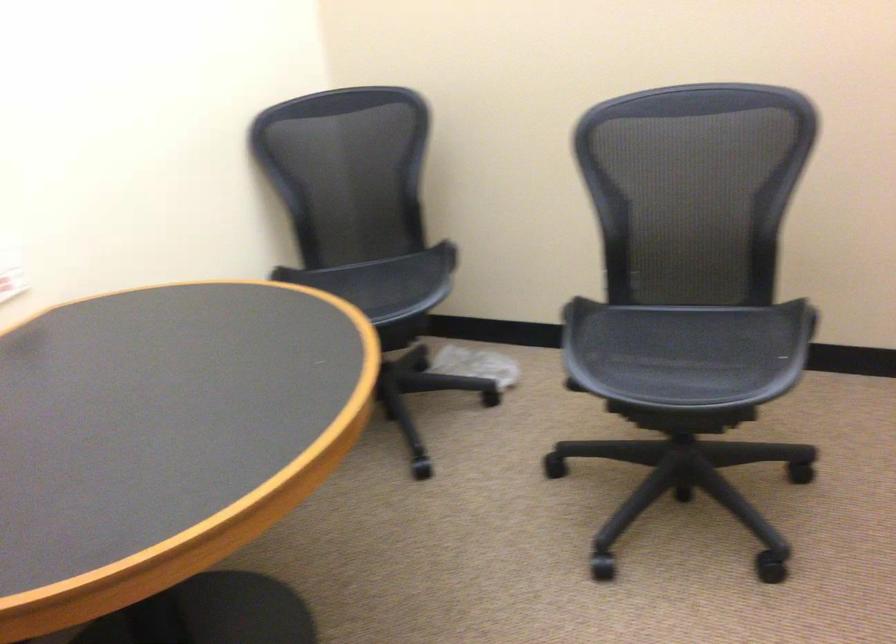
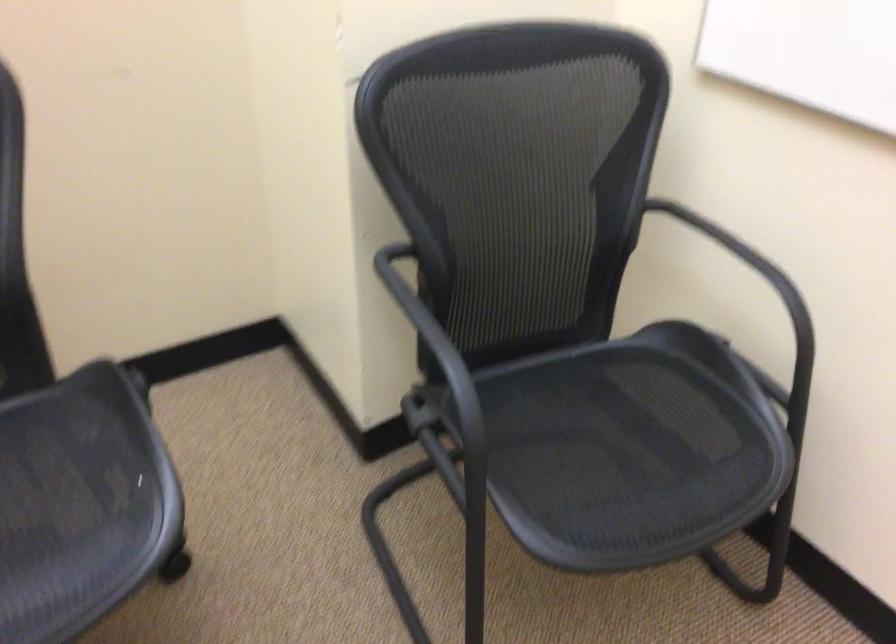
The point at (x=737, y=357) is marked in the first image. Where is the corresponding point in the second image?

(80, 503)